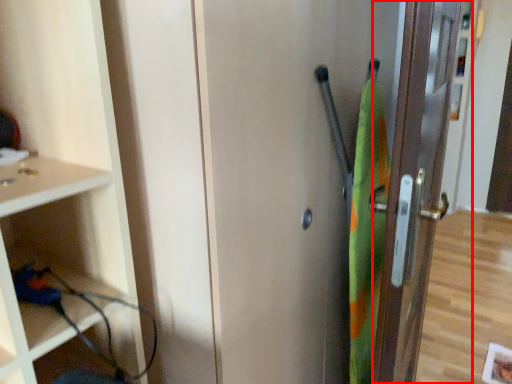
Question: From the image's perspective, what is the correct spatial relationship of door (annotated by the red box) in relation to screen door?

Choices:
 (A) above
 (B) below

Answer: (A)